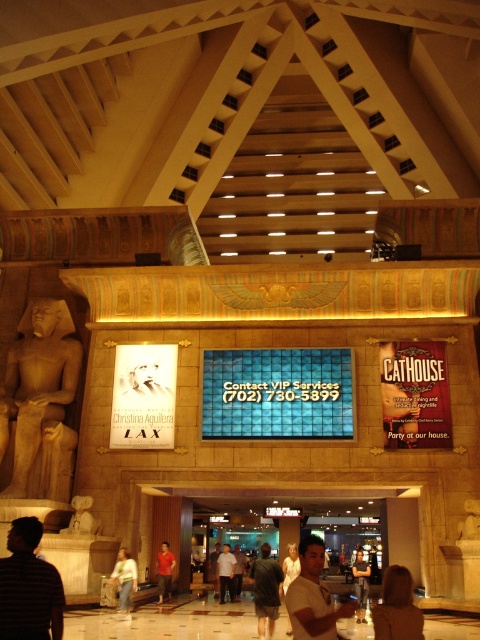
You are a guest at this venue and want to take a photo with both the polished beige statue at left and the matte white statue at lower left. Which statue should you position closer to the camera to ensure both are fully visible in the frame?

You should position the matte white statue at lower left closer to the camera because it is shorter than the polished beige statue at left, allowing both to fit within the camera frame more easily.